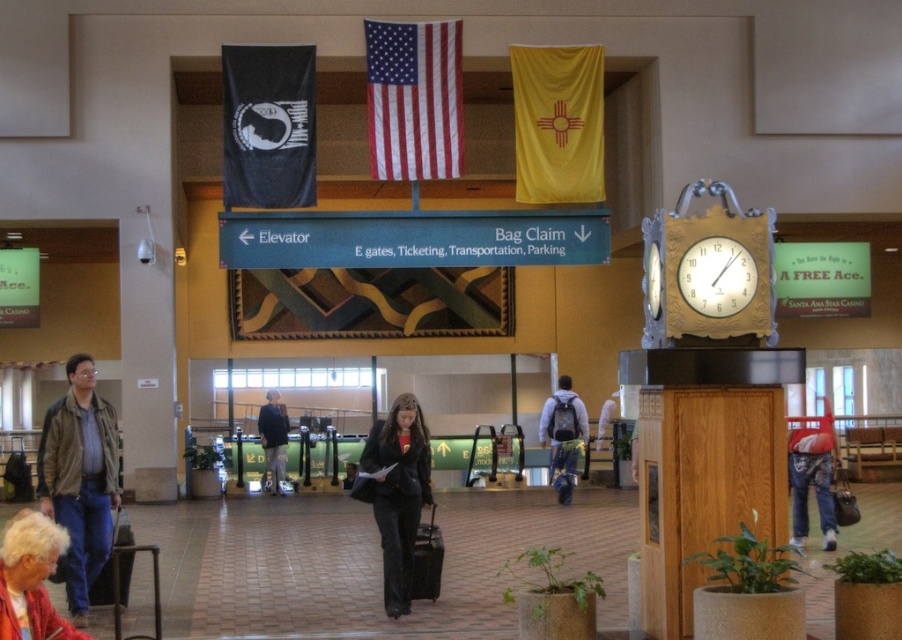
You are a traveler standing at the entrance of the airport terminal. You see the denim pants at right and the black textured suitcase at center. Which object is taller?

The denim pants at right is taller than the black textured suitcase at center.